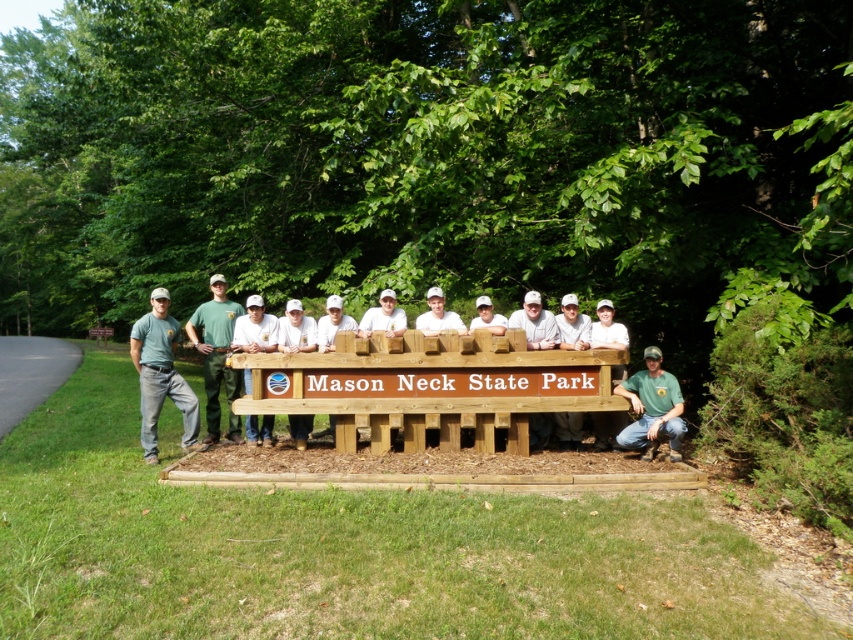
Question: Is matte green shirt at left to the left of green uniform at center from the viewer's perspective?

Choices:
 (A) no
 (B) yes

Answer: (B)

Question: Is matte green shirt at left below green uniform at center?

Choices:
 (A) no
 (B) yes

Answer: (B)

Question: Which point is closer to the camera?

Choices:
 (A) (154, 339)
 (B) (621, 385)
 (C) (215, 289)

Answer: (B)

Question: Is matte green shirt at left wider than green fabric shirt at lower right?

Choices:
 (A) no
 (B) yes

Answer: (A)

Question: Which of the following is the farthest from the observer?

Choices:
 (A) (192, 320)
 (B) (154, 328)

Answer: (A)

Question: Among these points, which one is nearest to the camera?

Choices:
 (A) (679, 428)
 (B) (144, 452)
 (C) (206, 371)

Answer: (A)